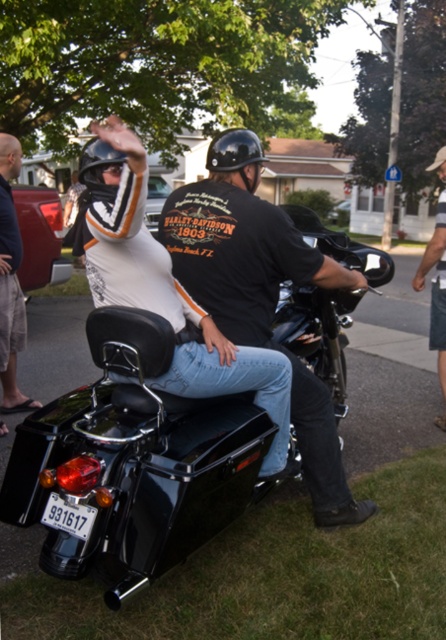
Question: Is black glossy motorcycle at center to the right of matte black helmet at upper left from the viewer's perspective?

Choices:
 (A) no
 (B) yes

Answer: (B)

Question: Does black matte helmet at center appear under matte black helmet at center?

Choices:
 (A) no
 (B) yes

Answer: (A)

Question: Among these points, which one is nearest to the camera?

Choices:
 (A) (331, 506)
 (B) (87, 161)
 (C) (441, 224)
 (D) (83, 461)

Answer: (D)

Question: Which of the following is the closest to the observer?

Choices:
 (A) (228, 170)
 (B) (195, 532)
 (C) (214, 250)
 (D) (20, 320)

Answer: (B)

Question: Which of the following is the closest to the observer?

Choices:
 (A) denim shorts at lower right
 (B) black matte helmet at center

Answer: (B)

Question: Can you confirm if black glossy motorcycle at center is positioned below matte black helmet at upper left?

Choices:
 (A) yes
 (B) no

Answer: (A)